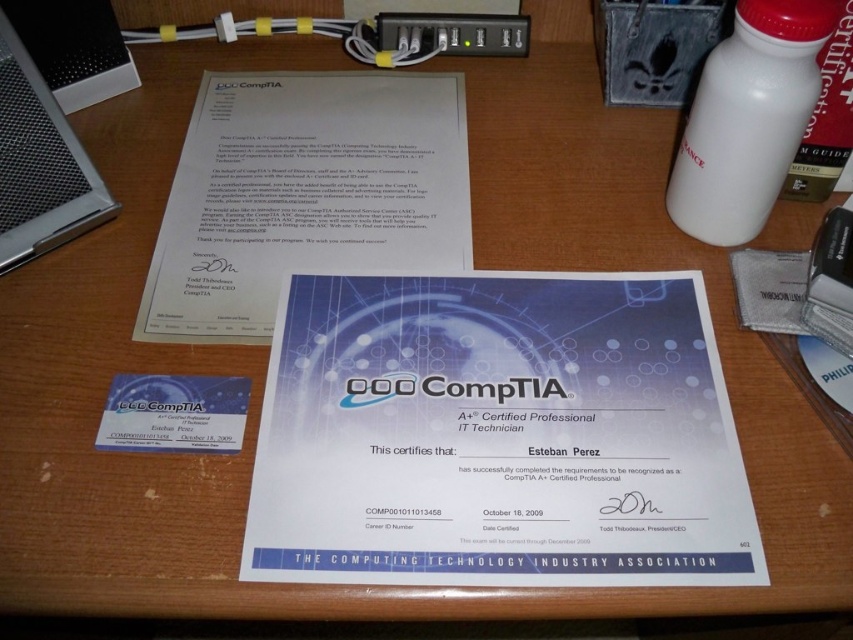
You are a photographer standing at the edge of the desk. You want to take a photo of the white paper at center with your camera. Can you reach the camera without moving from your current position?

The white paper at center and camera are 23.44 inches apart. Since you are at the edge of the desk, the distance between you and the camera is not specified, but the distance between the white paper and the camera is 23.44 inches. If you can reach 23.44 inches from the camera to the white paper, then yes, but the question is about your reach from your position. The problem doesn

You are a delivery person who needs to place a small package on the desk. The package must be placed exactly halfway between the certificate from CompTIA and the point at coordinates point [270,131]. How far in centimeters should you place the package from the certificate from CompTIA?

The package should be placed exactly halfway between the certificate from CompTIA and the point at coordinates point [270,131]. Since they are 76.44 centimeters apart, the halfway distance would be 76.44 divided by 2, which is 38.22 centimeters. Therefore, you should place the package 38.22 centimeters away from the certificate from CompTIA.